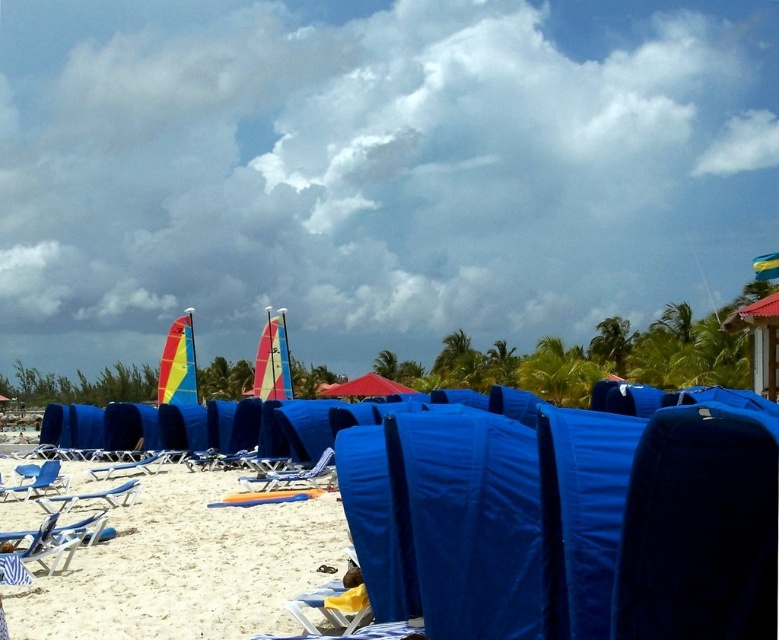
Question: Is white sandy beach at lower center wider than metallic blue lounge chair at center?

Choices:
 (A) yes
 (B) no

Answer: (B)

Question: Which of the following is the farthest from the observer?

Choices:
 (A) matte blue beach chair at lower left
 (B) metallic blue lounge chair at center

Answer: (B)

Question: Among these objects, which one is farthest from the camera?

Choices:
 (A) blue fabric chair at lower left
 (B) red fabric umbrella at center
 (C) white sandy beach at lower center

Answer: (B)

Question: Considering the relative positions of blue fabric chair at lower left and metallic blue lounge chair at center in the image provided, where is blue fabric chair at lower left located with respect to metallic blue lounge chair at center?

Choices:
 (A) below
 (B) above

Answer: (B)

Question: Which object is the closest to the metallic blue lounge chair at center?

Choices:
 (A) matte blue beach chair at lower left
 (B) red fabric umbrella at center
 (C) white sandy beach at lower center

Answer: (A)

Question: Does red fabric umbrella at center appear over matte blue beach chair at lower left?

Choices:
 (A) no
 (B) yes

Answer: (A)